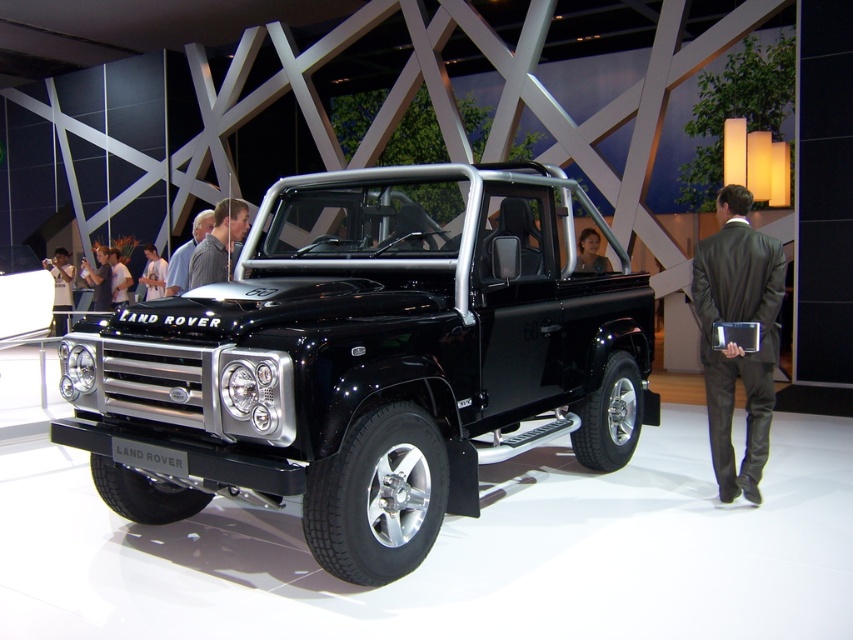
You are a photographer at an auto show and notice two shirts displayed on mannequins next to the Land Rover Defender. The shirts are a striped shirt at center and a white shirt at center. Which shirt is positioned closer to you?

The striped shirt at center is closer to the viewer than the white shirt at center.

From the picture: You are a fashion designer attending the auto show and see the dark gray suit at right and the matte black shirt at center. Which clothing item takes up more space in the image?

The matte black shirt at center occupies more space than the dark gray suit at right.

In the scene shown: You are a photographer standing in front of the Land Rover Defender at the auto show. You want to take a photo of the dark gray suit at right without moving closer than 4 meters. Can you do it?

The dark gray suit at right is 3.94 meters away from the viewer. Since you cannot move closer than 4 meters, you cannot take the photo without violating the distance requirement.